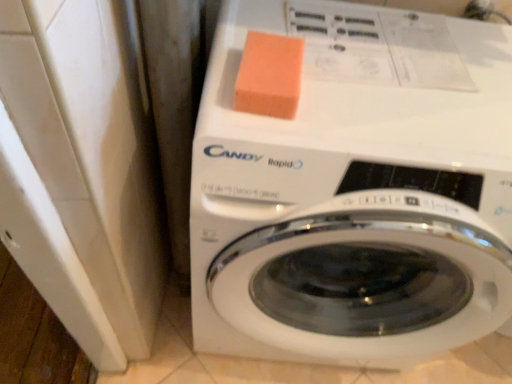
You are a GUI agent. You are given a task and a screenshot of the screen. Output one action in this format:
    pyautogui.click(x=<x>, y=<y>)
    Task: Click on the vacant space behind orange sponge at upper center
    The width and height of the screenshot is (512, 384).
    Given the screenshot: What is the action you would take?
    pyautogui.click(x=298, y=24)